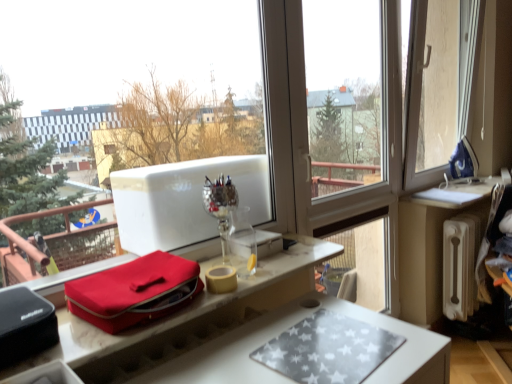
You are a GUI agent. You are given a task and a screenshot of the screen. Output one action in this format:
    pyautogui.click(x=<x>, y=<y>)
    Task: Click on the free location to the left of blue fabric iron at upper right
    This screenshot has height=384, width=512.
    Given the screenshot: What is the action you would take?
    pyautogui.click(x=445, y=185)